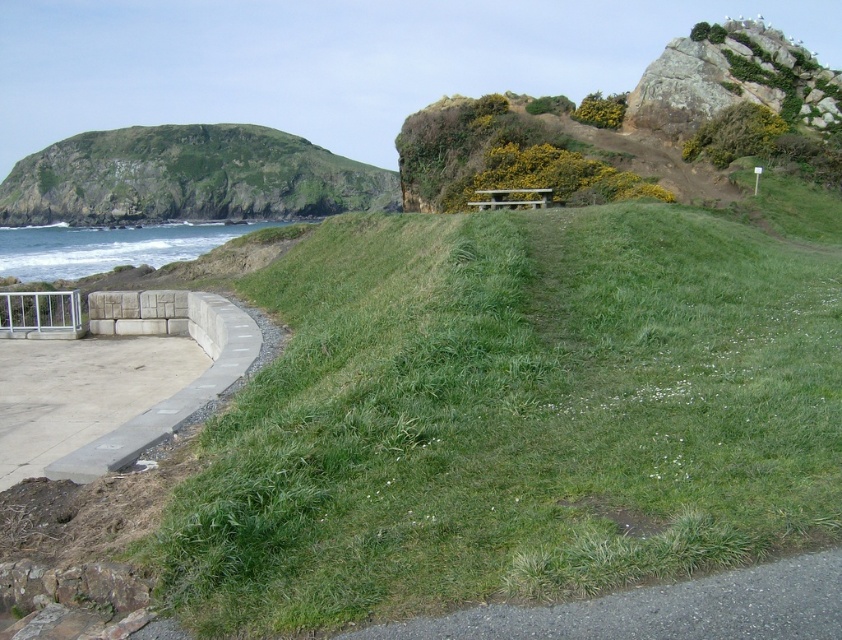
Find the location of `white metallic rail at left`. white metallic rail at left is located at coordinates (41, 314).

Does white metallic rail at left appear over light brown wooden bench at center?

Incorrect, white metallic rail at left is not positioned above light brown wooden bench at center.

Where is `white metallic rail at left`? The width and height of the screenshot is (842, 640). white metallic rail at left is located at coordinates (41, 314).

You are a GUI agent. You are given a task and a screenshot of the screen. Output one action in this format:
    pyautogui.click(x=<x>, y=<y>)
    Task: Click on the white metallic rail at left
    This screenshot has width=842, height=640.
    Given the screenshot: What is the action you would take?
    pyautogui.click(x=41, y=314)

Is point (766, 524) more distant than point (661, 589)?

Yes, it is behind point (661, 589).

Looking at this image, does green grassy hill at center lie in front of gray asphalt path at lower right?

No, green grassy hill at center is further to the viewer.

Locate an element on the screen. The width and height of the screenshot is (842, 640). green grassy hill at center is located at coordinates (512, 417).

Does gray asphalt path at lower right appear on the right side of light brown wooden bench at center?

No, gray asphalt path at lower right is not to the right of light brown wooden bench at center.

Who is positioned more to the right, gray asphalt path at lower right or light brown wooden bench at center?

light brown wooden bench at center is more to the right.

Which is in front, point (816, 611) or point (509, 198)?

Point (816, 611) is more forward.

In order to click on gray asphalt path at lower right in this screenshot , I will do `click(662, 609)`.